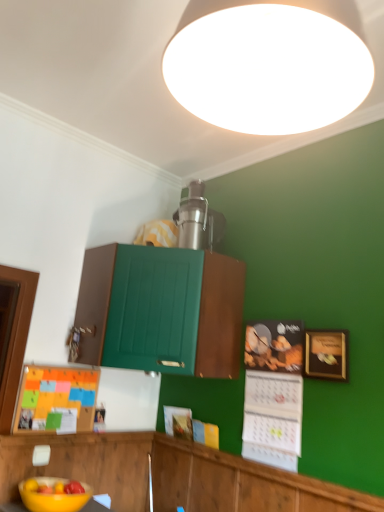
Question: Is yellow matte bowl at lower left outside gold-framed picture at right?

Choices:
 (A) yes
 (B) no

Answer: (A)

Question: From a real-world perspective, does yellow matte bowl at lower left sit lower than gold-framed picture at right?

Choices:
 (A) yes
 (B) no

Answer: (A)

Question: Is yellow matte bowl at lower left at the left side of gold-framed picture at right?

Choices:
 (A) no
 (B) yes

Answer: (B)

Question: Considering the relative sizes of yellow matte bowl at lower left and gold-framed picture at right in the image provided, is yellow matte bowl at lower left shorter than gold-framed picture at right?

Choices:
 (A) yes
 (B) no

Answer: (A)

Question: Considering the relative sizes of yellow matte bowl at lower left and gold-framed picture at right in the image provided, is yellow matte bowl at lower left smaller than gold-framed picture at right?

Choices:
 (A) no
 (B) yes

Answer: (A)

Question: Considering the positions of yellow matte bowl at lower left and wooden cabinet at lower center, the 1th cabinetry ordered from the bottom, in the image, is yellow matte bowl at lower left wider or thinner than wooden cabinet at lower center, the 1th cabinetry ordered from the bottom,?

Choices:
 (A) thin
 (B) wide

Answer: (B)

Question: Relative to wooden cabinet at lower center, the 1th cabinetry ordered from the bottom, is yellow matte bowl at lower left in front or behind?

Choices:
 (A) behind
 (B) front

Answer: (A)

Question: From a real-world perspective, is yellow matte bowl at lower left physically located above or below wooden cabinet at lower center, the 1th cabinetry ordered from the bottom?

Choices:
 (A) above
 (B) below

Answer: (B)

Question: From the image's perspective, is yellow matte bowl at lower left positioned above or below wooden cabinet at lower center, the 1th cabinetry ordered from the bottom?

Choices:
 (A) above
 (B) below

Answer: (B)

Question: Considering the positions of green matte cabinet at center, placed as the 2th cabinetry when sorted from bottom to top, and yellow matte bowl at lower left in the image, is green matte cabinet at center, placed as the 2th cabinetry when sorted from bottom to top, taller or shorter than yellow matte bowl at lower left?

Choices:
 (A) tall
 (B) short

Answer: (A)

Question: In terms of size, does green matte cabinet at center, arranged as the 1th cabinetry when viewed from the top, appear bigger or smaller than yellow matte bowl at lower left?

Choices:
 (A) big
 (B) small

Answer: (A)

Question: From the image's perspective, is green matte cabinet at center, placed as the 2th cabinetry when sorted from bottom to top, positioned above or below yellow matte bowl at lower left?

Choices:
 (A) above
 (B) below

Answer: (A)

Question: Which is correct: green matte cabinet at center, placed as the 2th cabinetry when sorted from bottom to top, is inside yellow matte bowl at lower left, or outside of it?

Choices:
 (A) outside
 (B) inside

Answer: (A)

Question: In terms of width, does white matte ceiling light at upper center look wider or thinner when compared to yellow matte bowl at lower left?

Choices:
 (A) wide
 (B) thin

Answer: (A)

Question: From the image's perspective, is white matte ceiling light at upper center located above or below yellow matte bowl at lower left?

Choices:
 (A) above
 (B) below

Answer: (A)